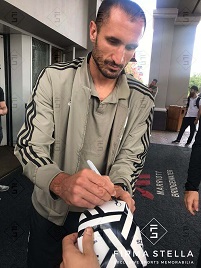
The image size is (201, 268). Find the location of `door`. door is located at coordinates (55, 55), (37, 54).